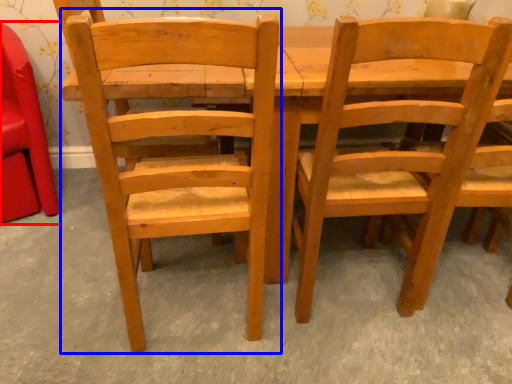
Question: Which object is closer to the camera taking this photo, chair (highlighted by a red box) or chair (highlighted by a blue box)?

Choices:
 (A) chair
 (B) chair

Answer: (B)